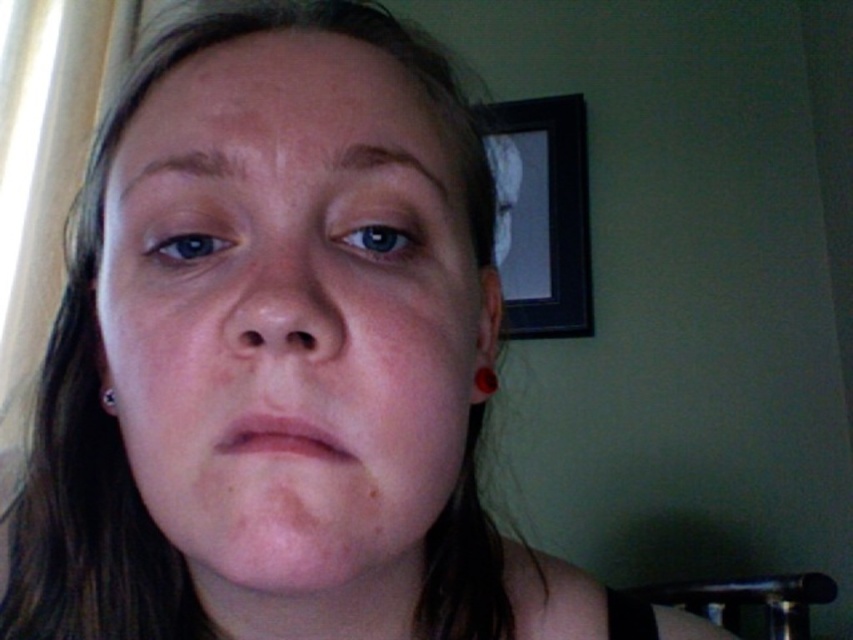
Between smooth skin face at center and black matte picture frame at upper right, which one appears on the right side from the viewer's perspective?

black matte picture frame at upper right

Is smooth skin face at center positioned in front of black matte picture frame at upper right?

Yes, it is.

Who is more distant from viewer, (x=270, y=116) or (x=509, y=125)?

Positioned behind is point (x=509, y=125).

I want to click on smooth skin face at center, so click(x=291, y=314).

Which is more to the left, smooth skin face at center or silver metallic earring at lower left?

smooth skin face at center is more to the left.

Measure the distance between point (439, 326) and camera.

A distance of 11.27 inches exists between point (439, 326) and camera.

Find the location of `smooth skin face at center`. smooth skin face at center is located at coordinates (291, 314).

Consider the image. Between black matte picture frame at upper right and red glossy earring at lower left, which one has more height?

black matte picture frame at upper right

Can you confirm if black matte picture frame at upper right is taller than red glossy earring at lower left?

Yes.

Locate an element on the screen. The image size is (853, 640). black matte picture frame at upper right is located at coordinates (544, 216).